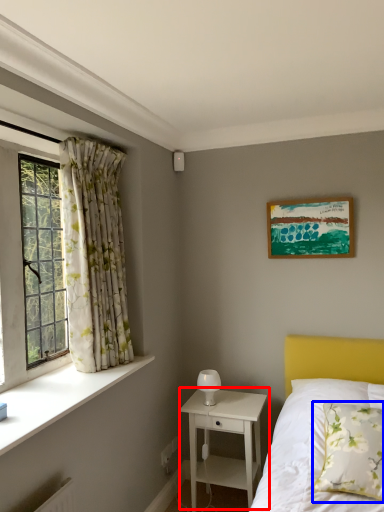
Question: Which object is closer to the camera taking this photo, nightstand (highlighted by a red box) or pillow (highlighted by a blue box)?

Choices:
 (A) nightstand
 (B) pillow

Answer: (B)